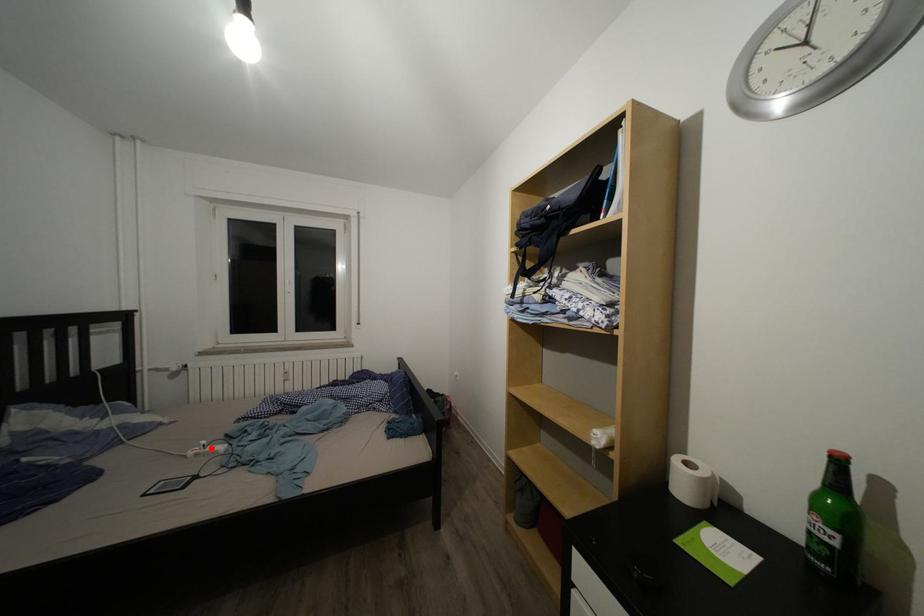
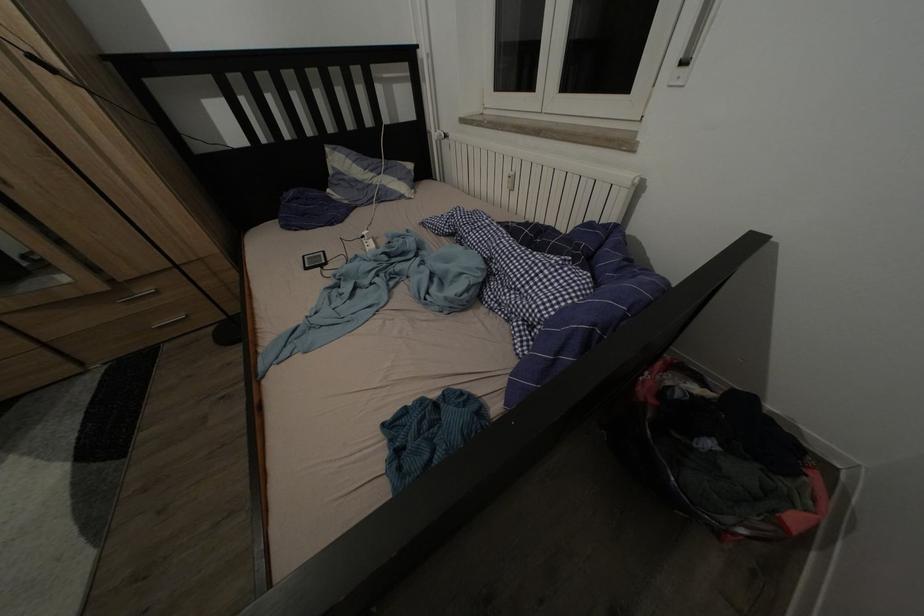
Where in the second image is the point corresponding to the highlighted location from the first image?

(372, 238)